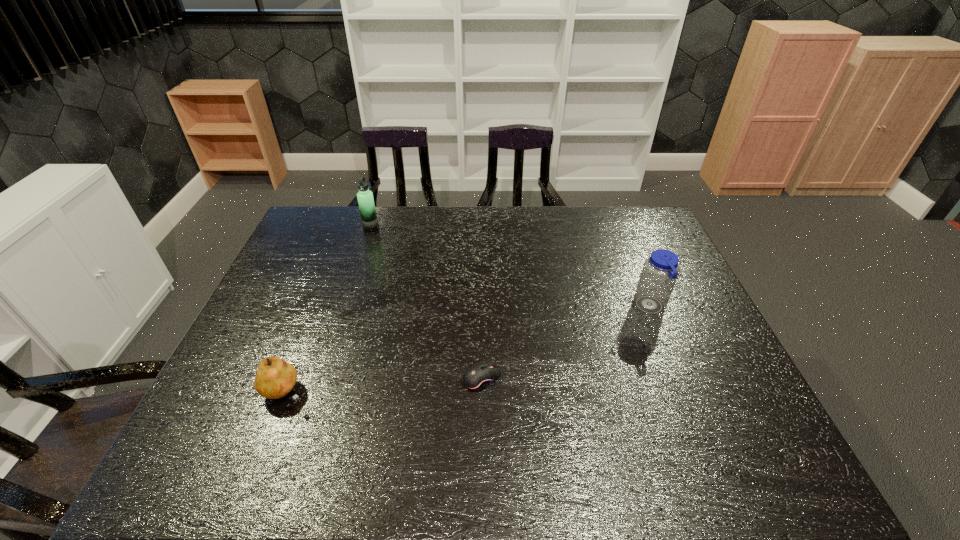
Identify the location of blank space located 0.320m on the back of the pear. (326, 288).

Locate an element on the screen. vacant space located 0.170m on the back of the second object from right to left is located at coordinates (481, 316).

Find the location of a particular element. object located at the far edge is located at coordinates (365, 198).

At what (x,y) coordinates should I click in order to perform the action: click on object located in the left edge section of the desktop. Please return your answer as a coordinate pair (x, y). The width and height of the screenshot is (960, 540). Looking at the image, I should click on (275, 378).

Where is `object situated at the right edge`? object situated at the right edge is located at coordinates (660, 271).

In the image, there is a desktop. Identify the location of free space at the far edge. (569, 230).

Where is `vacant space at the near edge of the desktop`? vacant space at the near edge of the desktop is located at coordinates (615, 477).

Identify the location of vacant area at the left edge of the desktop. The image size is (960, 540). (313, 262).

You are a GUI agent. You are given a task and a screenshot of the screen. Output one action in this format:
    pyautogui.click(x=<x>, y=<y>)
    Task: Click on the vacant area at the right edge
    The height and width of the screenshot is (540, 960).
    Given the screenshot: What is the action you would take?
    pyautogui.click(x=689, y=295)

At what (x,y) coordinates should I click in order to perform the action: click on vacant space at the far left corner. Please return your answer as a coordinate pair (x, y). The height and width of the screenshot is (540, 960). Looking at the image, I should click on (319, 228).